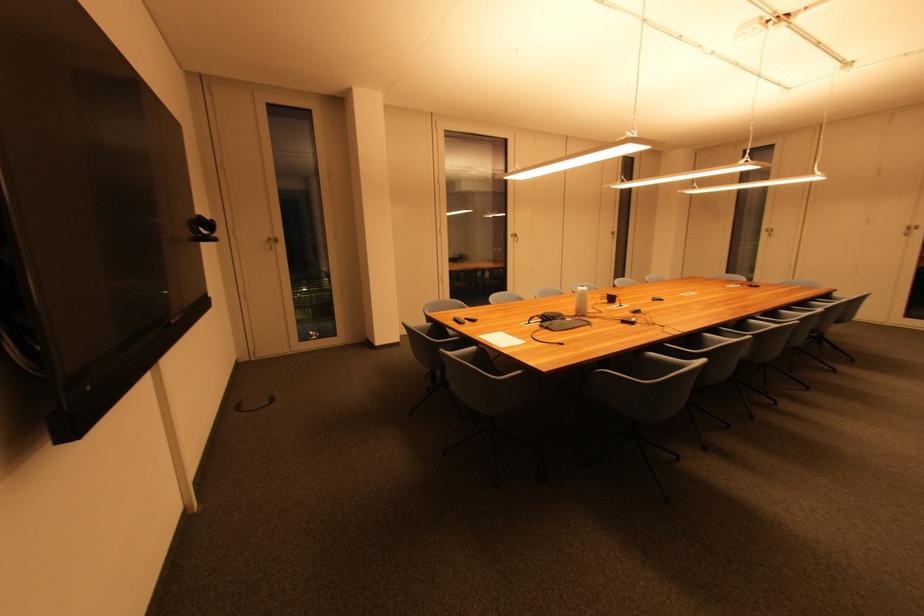
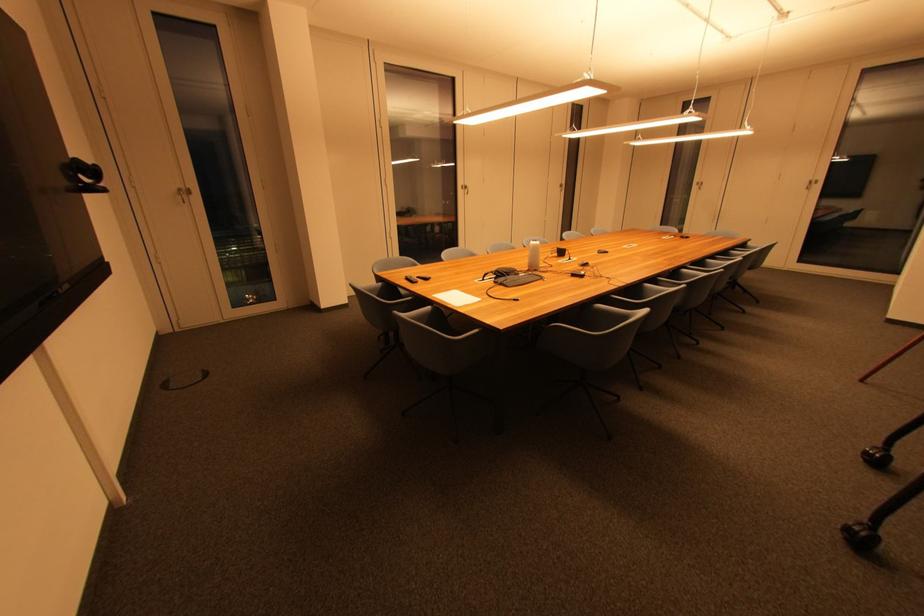
In the second image, find the point that corresponds to the point at 479,350 in the first image.

(433, 310)